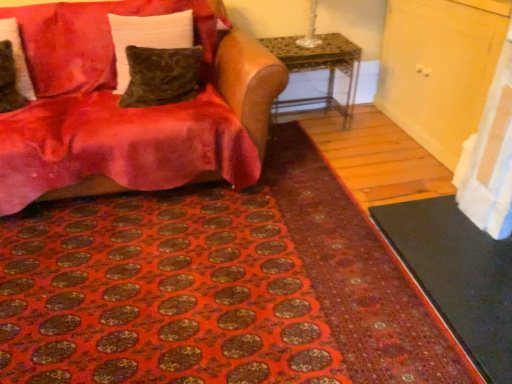
I want to click on free space that is to the left of black rubber doormat at lower right, so click(320, 271).